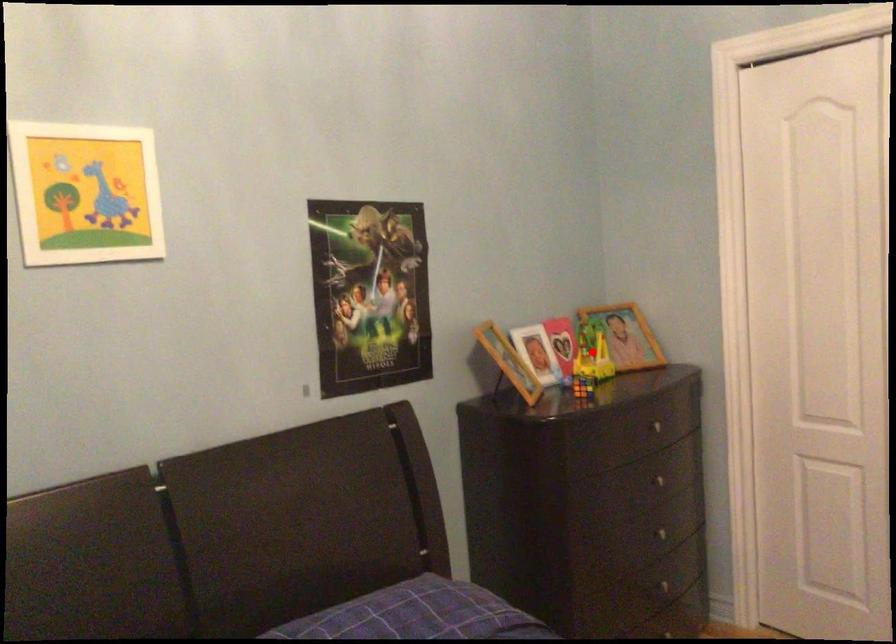
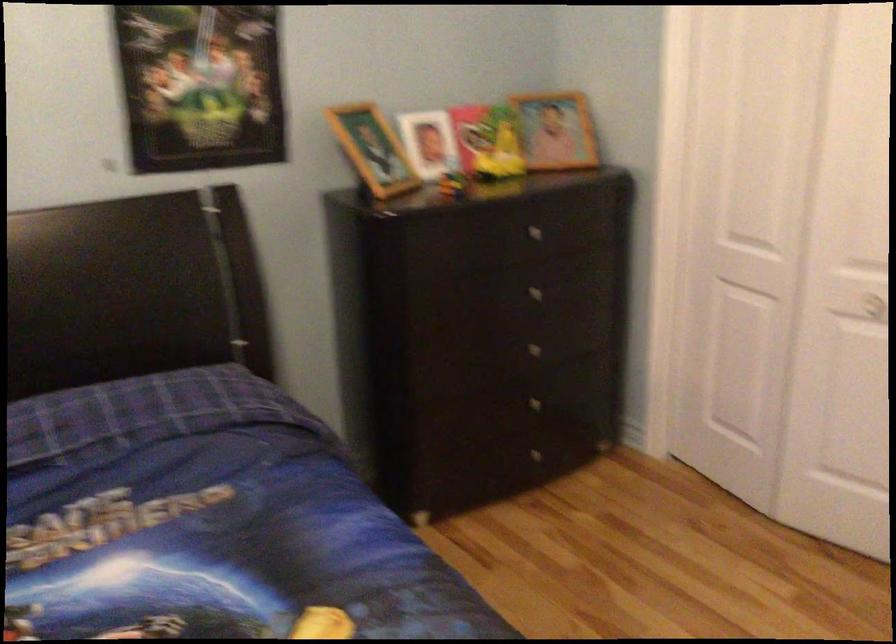
In the second image, find the point that corresponds to the highlighted location in the first image.

(487, 142)